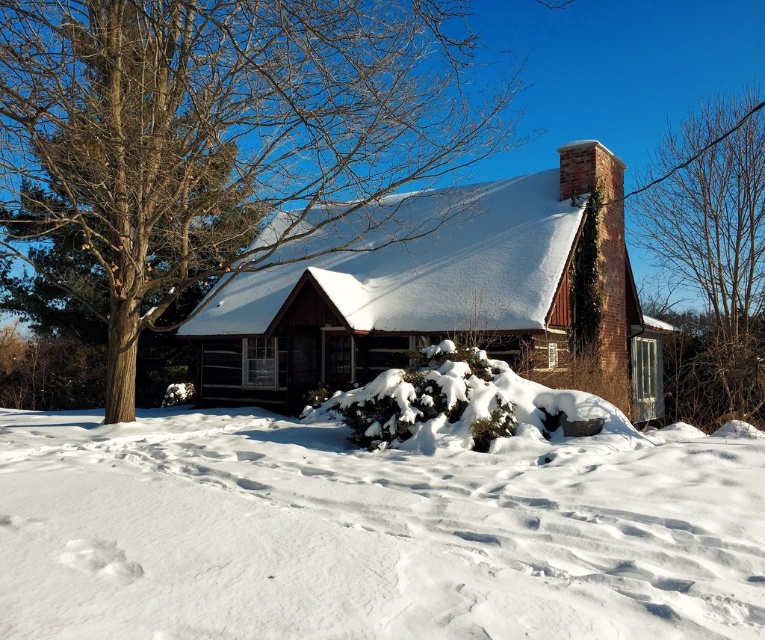
Who is higher up, brown wood tree at upper left or brown wooden cabin at center?

Positioned higher is brown wood tree at upper left.

Who is shorter, brown wood tree at upper left or brown wooden cabin at center?

brown wooden cabin at center

Which is behind, point (347, 8) or point (599, 364)?

The point (599, 364) is more distant.

The width and height of the screenshot is (765, 640). I want to click on brown wood tree at upper left, so click(220, 140).

Which is in front, point (391, 554) or point (215, 369)?

Point (391, 554) is more forward.

Which is in front, point (396, 612) or point (326, 376)?

Point (396, 612) is more forward.

You are a GUI agent. You are given a task and a screenshot of the screen. Output one action in this format:
    pyautogui.click(x=<x>, y=<y>)
    Task: Click on the white fluffy snow at lower center
    This screenshot has height=640, width=765.
    Given the screenshot: What is the action you would take?
    pyautogui.click(x=370, y=532)

Does brown wood tree at upper left have a greater height compared to bare branches at upper right?

Correct, brown wood tree at upper left is much taller as bare branches at upper right.

Does brown wood tree at upper left have a larger size compared to bare branches at upper right?

Yes.

Between point (161, 250) and point (710, 312), which one is positioned in front?

Point (161, 250)

The width and height of the screenshot is (765, 640). I want to click on brown wood tree at upper left, so click(220, 140).